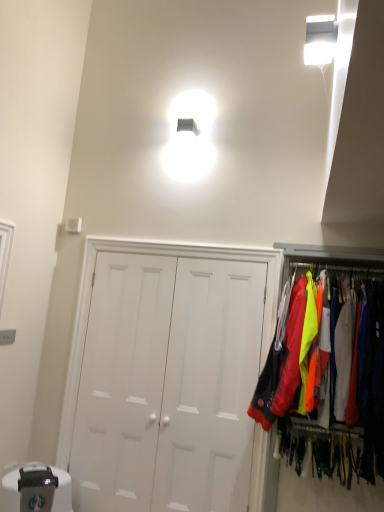
Question: Visually, is white matte door at center positioned to the left or to the right of neon fabric jackets at right?

Choices:
 (A) right
 (B) left

Answer: (B)

Question: From their relative heights in the image, would you say white matte door at center is taller or shorter than neon fabric jackets at right?

Choices:
 (A) tall
 (B) short

Answer: (A)

Question: Looking at their shapes, would you say white matte door at center is wider or thinner than neon fabric jackets at right?

Choices:
 (A) wide
 (B) thin

Answer: (B)

Question: Visually, is neon fabric jackets at right positioned to the left or to the right of white matte door at center?

Choices:
 (A) right
 (B) left

Answer: (A)

Question: In terms of width, does neon fabric jackets at right look wider or thinner when compared to white matte door at center?

Choices:
 (A) thin
 (B) wide

Answer: (B)

Question: From a real-world perspective, relative to white matte door at center, is neon fabric jackets at right vertically above or below?

Choices:
 (A) below
 (B) above

Answer: (B)

Question: Considering the positions of neon fabric jackets at right and white matte door at center in the image, is neon fabric jackets at right bigger or smaller than white matte door at center?

Choices:
 (A) small
 (B) big

Answer: (B)